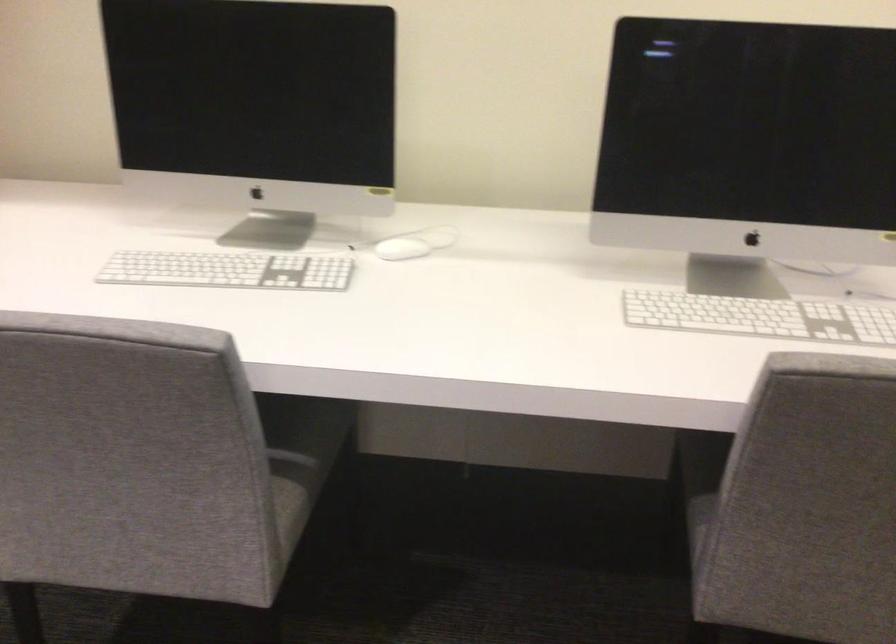
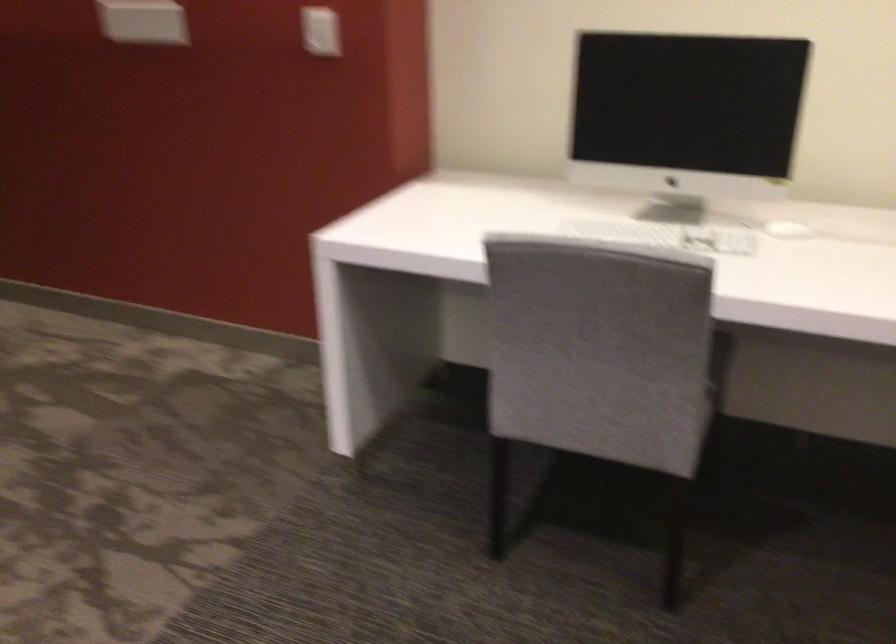
The point at (x=402, y=259) is marked in the first image. Where is the corresponding point in the second image?

(786, 230)